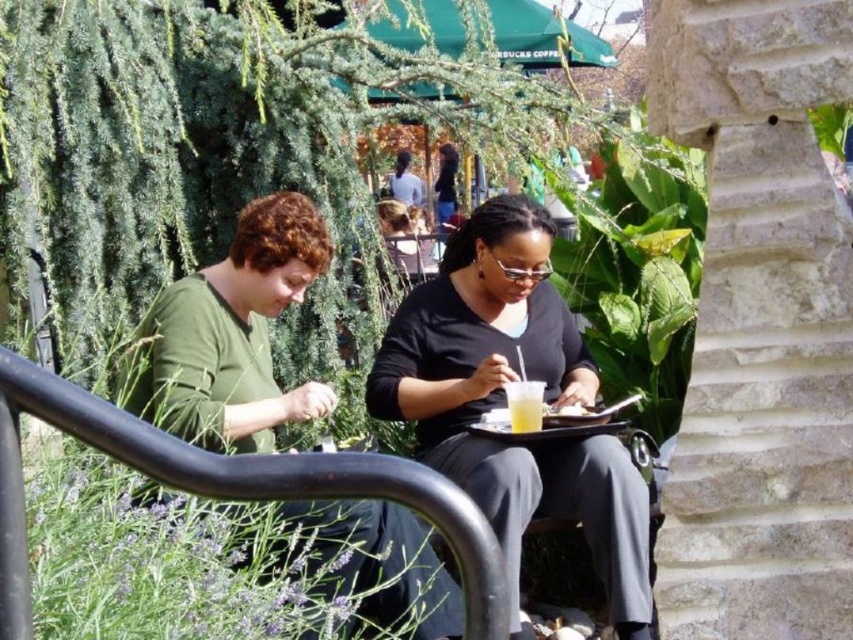
Image resolution: width=853 pixels, height=640 pixels. What do you see at coordinates (505, 401) in the screenshot? I see `black matte shirt at center` at bounding box center [505, 401].

Does black matte shirt at center lie behind dark brown hair at center?

No, black matte shirt at center is in front of dark brown hair at center.

Does point (569, 440) come in front of point (436, 209)?

Yes, it is.

Where is `black matte shirt at center`? The image size is (853, 640). black matte shirt at center is located at coordinates (505, 401).

Is point (447, 449) less distant than point (517, 388)?

No, (447, 449) is behind (517, 388).

Does black matte shirt at center have a smaller size compared to translucent plastic cup at center?

No, black matte shirt at center is not smaller than translucent plastic cup at center.

Locate an element on the screen. The width and height of the screenshot is (853, 640). black matte shirt at center is located at coordinates (505, 401).

Is translucent plastic cup at center positioned at the back of dark brown hair at center?

No, translucent plastic cup at center is closer to the viewer.

In the scene shown: Can you confirm if translucent plastic cup at center is smaller than dark brown hair at center?

Yes, translucent plastic cup at center is smaller than dark brown hair at center.

Is point (515, 424) farther from camera compared to point (442, 145)?

No, (515, 424) is in front of (442, 145).

Find the location of a particular element. The width and height of the screenshot is (853, 640). translucent plastic cup at center is located at coordinates (524, 404).